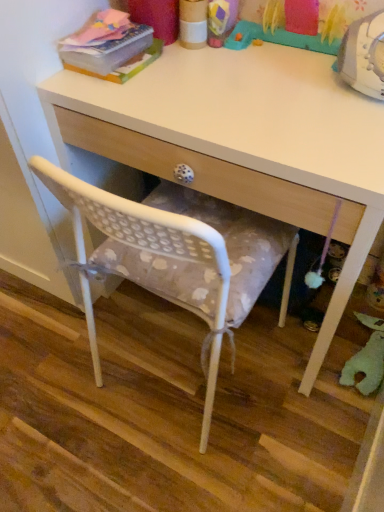
The height and width of the screenshot is (512, 384). What are the coordinates of `space that is in front of white wood desk at center` in the screenshot? It's located at (221, 452).